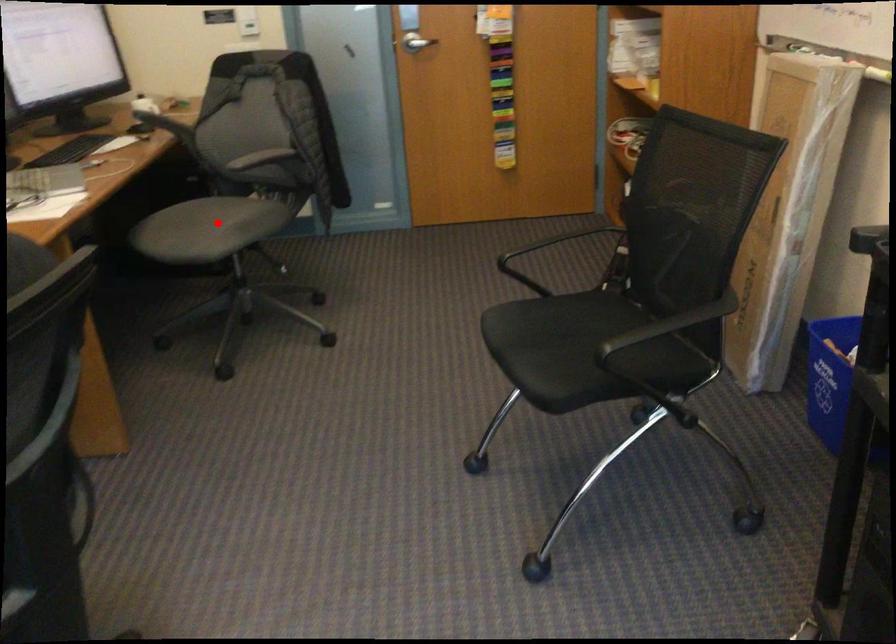
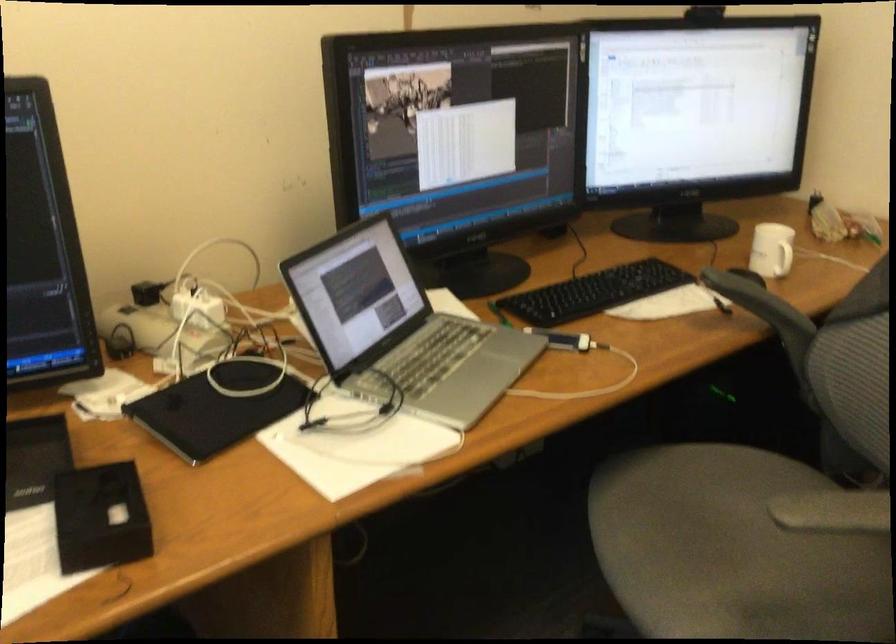
Find the pixel in the second image that matches the highlighted location in the first image.

(733, 550)